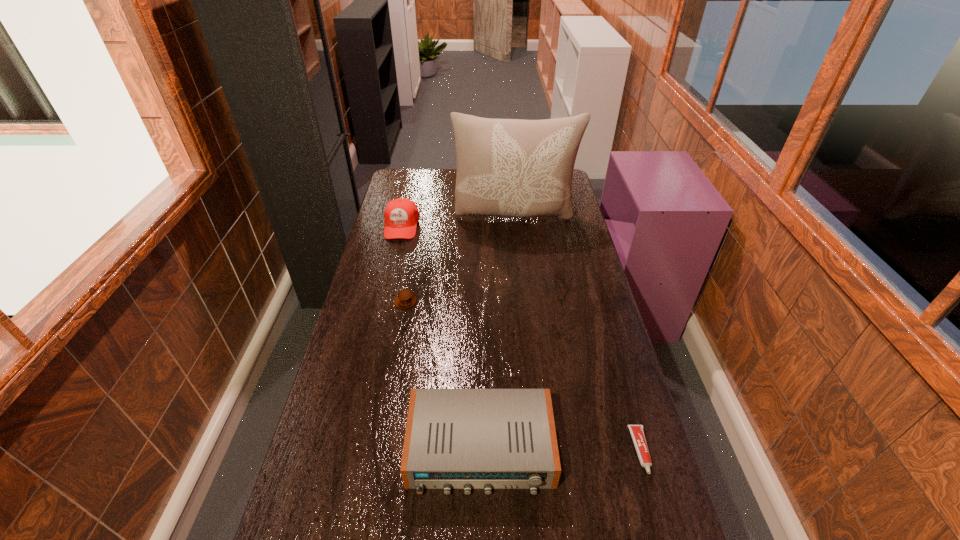
Image resolution: width=960 pixels, height=540 pixels. What are the coordinates of `free space between the toothpaste and the third farthest object` in the screenshot? It's located at (523, 376).

Where is `free space between the toothpaste and the cushion`? The height and width of the screenshot is (540, 960). free space between the toothpaste and the cushion is located at coordinates (578, 334).

Identify the location of free space between the fourth shortest object and the third tallest object. The image size is (960, 540). (441, 338).

Locate an element on the screen. The height and width of the screenshot is (540, 960). vacant space in between the fourth tallest object and the shortest object is located at coordinates (523, 376).

Where is `free spot between the toothpaste and the third nearest object`? free spot between the toothpaste and the third nearest object is located at coordinates (523, 376).

Identify the location of vacant area that lies between the radio receiver and the tallest object. (497, 333).

You are a GUI agent. You are given a task and a screenshot of the screen. Output one action in this format:
    pyautogui.click(x=<x>, y=<y>)
    Task: Click on the vacant area that lies between the fourth shortest object and the toothpaste
    The height and width of the screenshot is (540, 960).
    Given the screenshot: What is the action you would take?
    pos(521,339)

In order to click on object that can be found as the fourth closest to the third tallest object in this screenshot , I will do `click(518, 168)`.

Where is `object identified as the fourth closest to the shortest object`? This screenshot has height=540, width=960. object identified as the fourth closest to the shortest object is located at coordinates pyautogui.click(x=401, y=215).

Find the location of `vacant position in the image that satisfies the following two spatial constraints: 1. on the front panel of the baseball cap; 2. on the left side of the muffin`. vacant position in the image that satisfies the following two spatial constraints: 1. on the front panel of the baseball cap; 2. on the left side of the muffin is located at coordinates (384, 301).